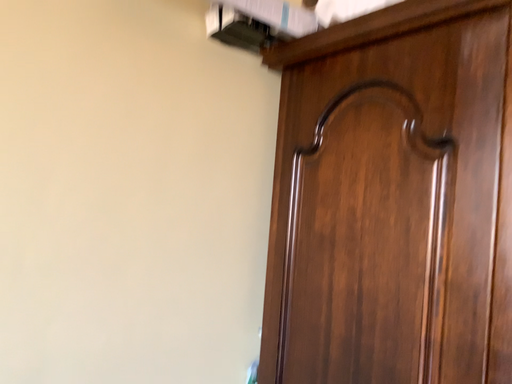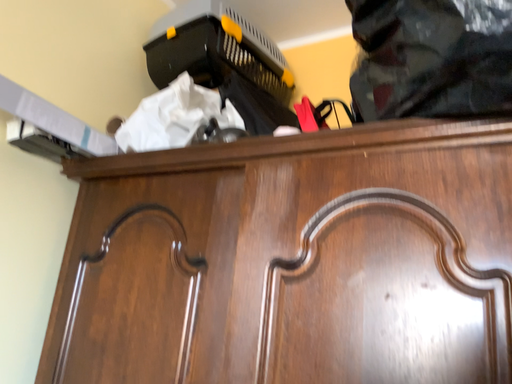
Question: Which way did the camera rotate in the video?

Choices:
 (A) rotated upward
 (B) rotated downward

Answer: (A)